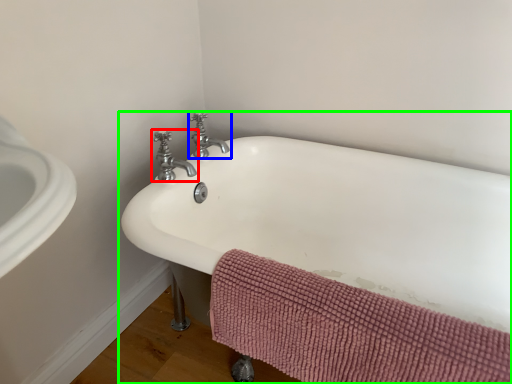
Question: Based on their relative distances, which object is nearer to tap (highlighted by a red box)? Choose from tap (highlighted by a blue box) and bathtub (highlighted by a green box).

Choices:
 (A) tap
 (B) bathtub

Answer: (A)